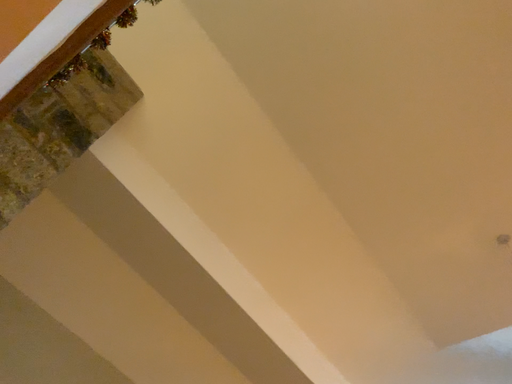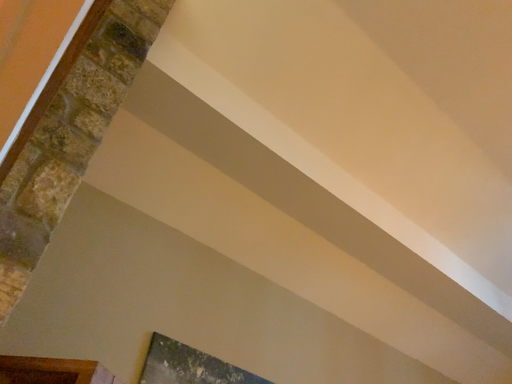
Question: Which way did the camera rotate in the video?

Choices:
 (A) rotated downward
 (B) rotated upward

Answer: (A)